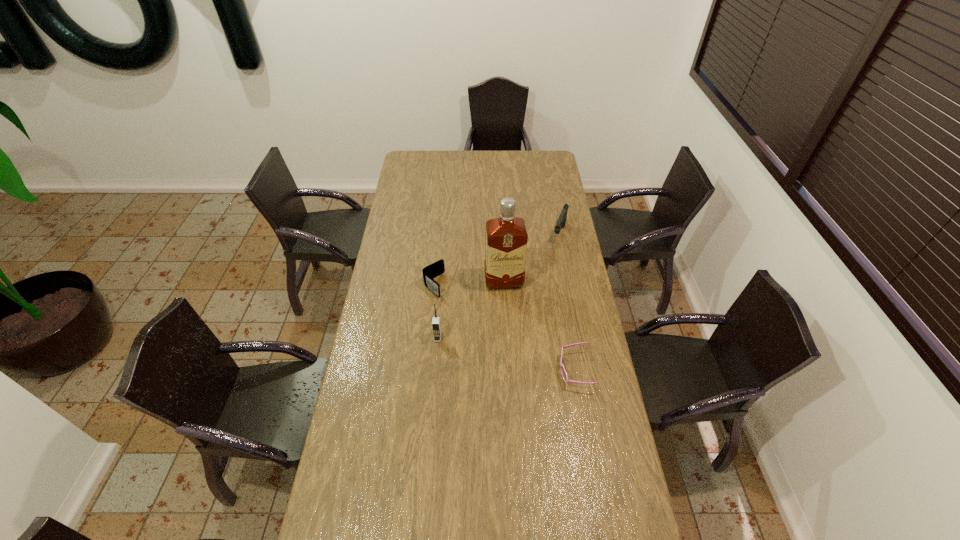
Where is `cellular telephone`? This screenshot has width=960, height=540. cellular telephone is located at coordinates (436, 326).

At what (x,y) coordinates should I click in order to perform the action: click on the second nearest object. Please return your answer as a coordinate pair (x, y). This screenshot has height=540, width=960. Looking at the image, I should click on (436, 326).

The height and width of the screenshot is (540, 960). I want to click on the nearest object, so pyautogui.click(x=564, y=374).

This screenshot has width=960, height=540. Find the location of `sunglasses`. sunglasses is located at coordinates (564, 374).

You are a GUI agent. You are given a task and a screenshot of the screen. Output one action in this format:
    pyautogui.click(x=<x>, y=<y>)
    Task: Click on the liquor
    This screenshot has width=960, height=540.
    Given the screenshot: What is the action you would take?
    pyautogui.click(x=506, y=239)

Locate an element on the screen. the tallest object is located at coordinates (506, 239).

You are a GUI agent. You are given a task and a screenshot of the screen. Output one action in this format:
    pyautogui.click(x=<x>, y=<y>)
    Task: Click on the wallet
    This screenshot has width=960, height=540.
    Given the screenshot: What is the action you would take?
    pyautogui.click(x=433, y=270)

What are the coordinates of `the third shortest object` in the screenshot? It's located at (561, 221).

Where is `pistol`? The width and height of the screenshot is (960, 540). pistol is located at coordinates (561, 221).

Where is `vacant space located 0.270m on the front-facing side of the fourth shortest object`? The image size is (960, 540). vacant space located 0.270m on the front-facing side of the fourth shortest object is located at coordinates (432, 406).